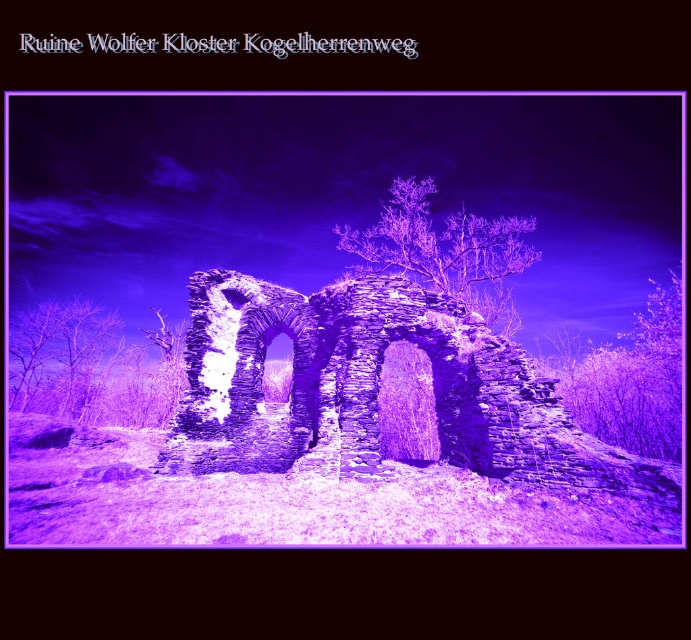
What do you see at coordinates (372, 388) in the screenshot? I see `stone arches at center` at bounding box center [372, 388].

Can you confirm if stone arches at center is positioned to the right of purple stone tree at center?

In fact, stone arches at center is to the left of purple stone tree at center.

Is point (281, 468) more distant than point (426, 186)?

That is False.

Locate an element on the screen. This screenshot has height=640, width=691. stone arches at center is located at coordinates (372, 388).

How distant is purple textured tree at right from purple stone tree at center?

purple textured tree at right and purple stone tree at center are 21.68 meters apart.

Can you confirm if purple textured tree at right is positioned to the right of purple stone tree at center?

Indeed, purple textured tree at right is positioned on the right side of purple stone tree at center.

Which is behind, point (674, 298) or point (473, 298)?

The point (674, 298) is behind.

Where is `purple textured tree at right`? purple textured tree at right is located at coordinates (630, 380).

Between stone arches at center and purple textured tree at right, which one appears on the right side from the viewer's perspective?

From the viewer's perspective, purple textured tree at right appears more on the right side.

Who is more forward, (627, 452) or (681, 321)?

Positioned in front is point (627, 452).

Which is behind, point (269, 417) or point (643, 314)?

Positioned behind is point (643, 314).

At what (x,y) coordinates should I click in order to perform the action: click on stone arches at center. Please return your answer as a coordinate pair (x, y). The height and width of the screenshot is (640, 691). Looking at the image, I should click on (372, 388).